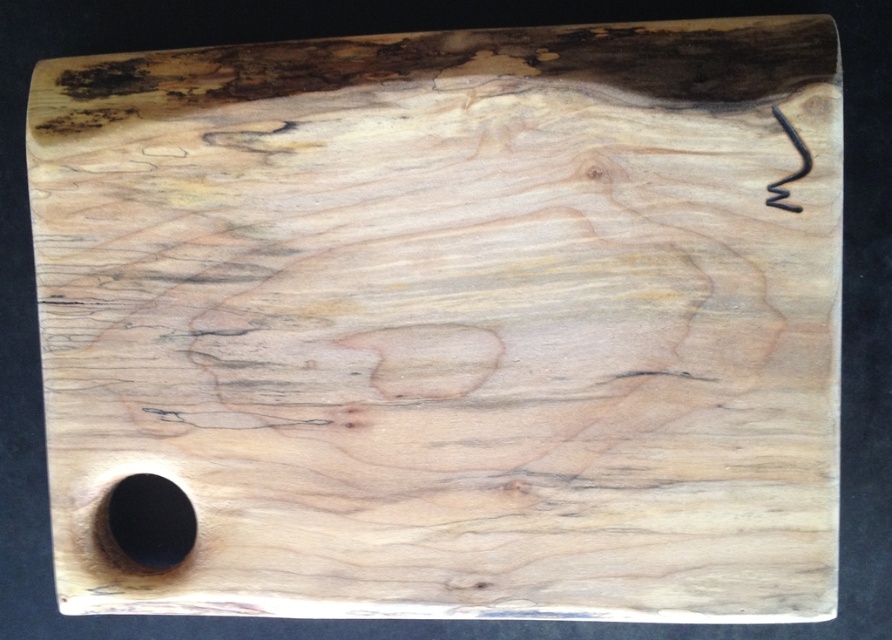
You are a GUI agent. You are given a task and a screenshot of the screen. Output one action in this format:
    pyautogui.click(x=<x>, y=<y>)
    Task: Click on the black matte hole at bottom left
    
    Given the screenshot: What is the action you would take?
    pyautogui.click(x=151, y=520)

Can you confirm if black matte hole at bottom left is smaller than matte black hook at upper right?

No, black matte hole at bottom left is not smaller than matte black hook at upper right.

Identify the location of black matte hole at bottom left. pos(151,520).

Find the location of `black matte hole at bottom left`. black matte hole at bottom left is located at coordinates (151, 520).